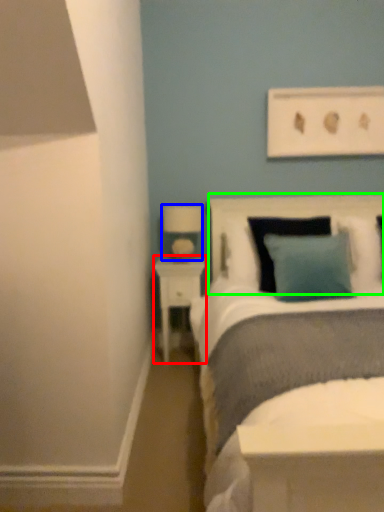
Question: Which object is the farthest from nightstand (highlighted by a red box)? Choose among these: lamp (highlighted by a blue box) or headboard (highlighted by a green box).

Choices:
 (A) lamp
 (B) headboard

Answer: (B)